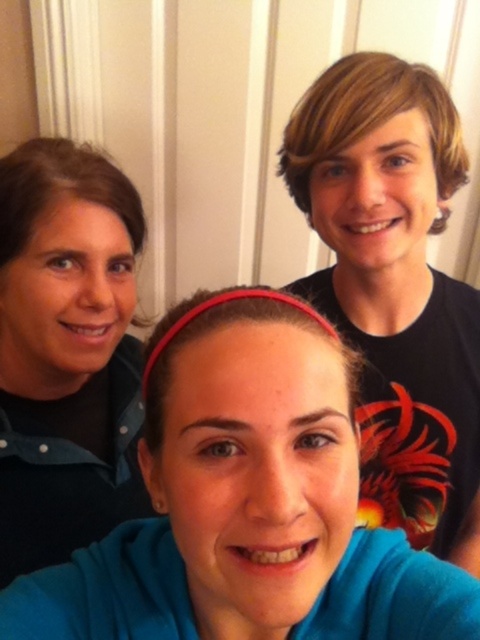
You are trying to identify the positions of two people in the photo based on their clothing. The black matte shirt at upper right and the matte black shirt at left are both wearing black shirts. Which one is standing to the right of the other?

The black matte shirt at upper right is positioned on the right side of matte black shirt at left, so the black matte shirt at upper right is standing to the right of the matte black shirt at left.

You are a photographer trying to focus on the closest person wearing a black matte shirt at upper right and the matte black shirt at left. Which one should you adjust your camera focus on first to ensure the closest subject is sharp?

The black matte shirt at upper right is closer to the viewer than the matte black shirt at left, so you should focus on the black matte shirt at upper right first to ensure the closest subject is sharp.